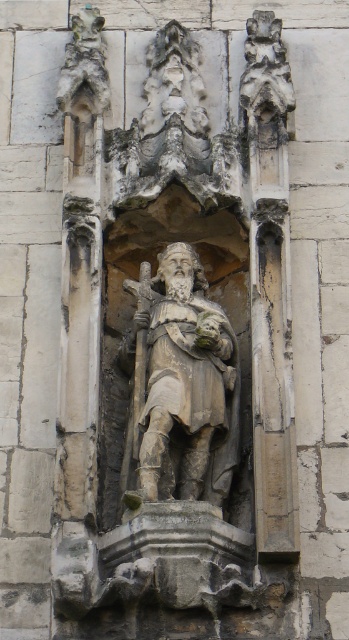
You are an art conservator examining the stone relief sculpture. You notice two points on the sculpture labeled as point 1 at coordinates point (211, 433) and point 2 at coordinates point (281, 134). Which point is nearer to you when you are standing in front of the sculpture?

Point (211, 433) is closer to the viewer than point (281, 134).

You are an archaeologist examining the stone relief sculpture. You notice a specific point marked at coordinates (181, 387). What does this point indicate?

The point at coordinates (181, 387) marks the location of the stone statue at the center of the relief sculpture.